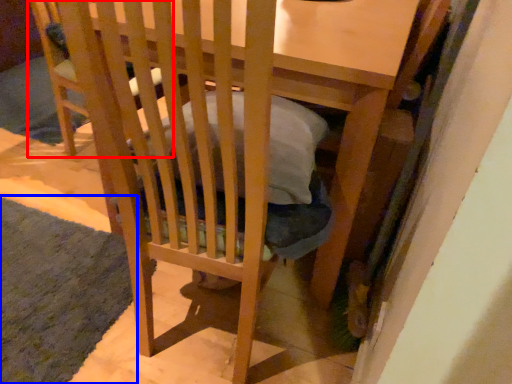
Question: Among these objects, which one is farthest to the camera, folding chair (highlighted by a red box) or mat (highlighted by a blue box)?

Choices:
 (A) folding chair
 (B) mat

Answer: (A)